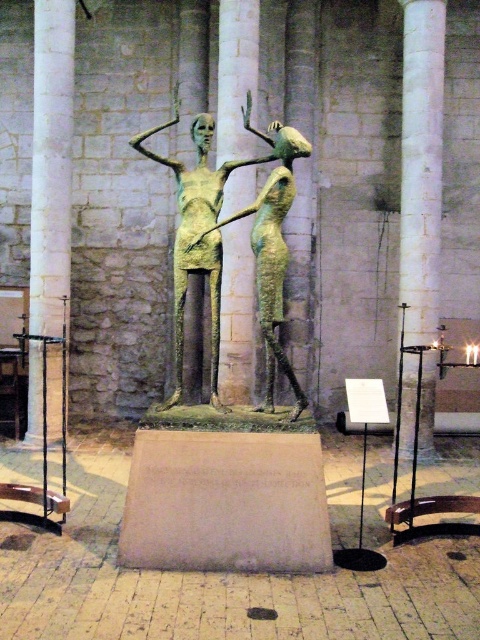
Which is in front, point (180, 349) or point (222, 19)?

Point (180, 349) is in front.

Who is taller, green patina bronze sculpture at center or bronze statue at center?

Standing taller between the two is bronze statue at center.

The width and height of the screenshot is (480, 640). What do you see at coordinates (210, 221) in the screenshot?
I see `green patina bronze sculpture at center` at bounding box center [210, 221].

What are the coordinates of `green patina bronze sculpture at center` in the screenshot? It's located at (210, 221).

Between white stone column at left and green patina bronze sculpture at center, which one is positioned higher?

white stone column at left is higher up.

Who is positioned more to the right, white stone column at left or green patina bronze sculpture at center?

green patina bronze sculpture at center

Locate an element on the screen. The width and height of the screenshot is (480, 640). white stone column at left is located at coordinates (50, 163).

Between point (424, 182) and point (60, 67), which one is positioned behind?

The point (60, 67) is more distant.

Is point (403, 177) farther from camera compared to point (67, 268)?

No.

Identify the location of white marble pillar at right. (420, 164).